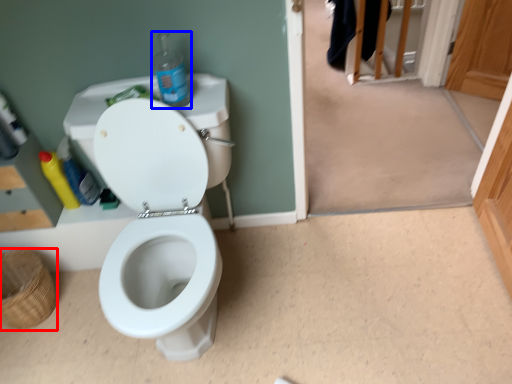
Question: Among these objects, which one is nearest to the camera, basket (highlighted by a red box) or bottle (highlighted by a blue box)?

Choices:
 (A) basket
 (B) bottle

Answer: (B)